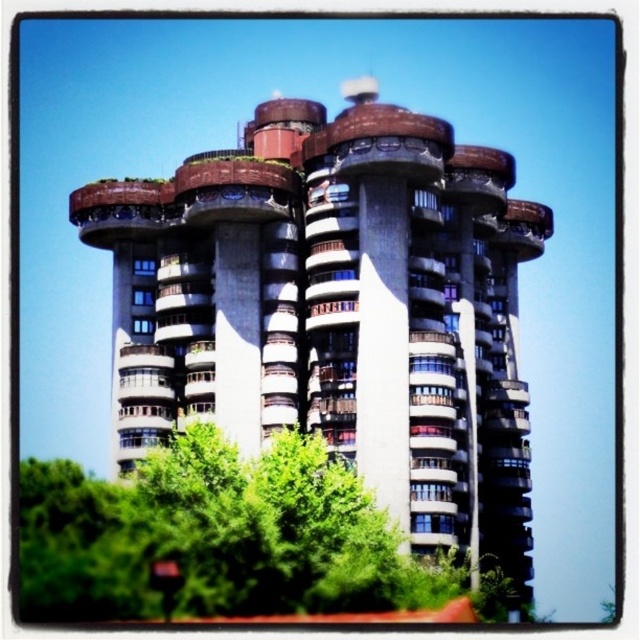
You are a bird looking for a place to perch. You can choose between the concrete building at center and the green leafy tree at lower center. Which option is taller?

The concrete building at center is much taller than the green leafy tree at lower center, so the bird should choose the concrete building at center for a higher perch.

You are an architect evaluating the design of the concrete building at center and the green leafy tree at lower center. Which object has a smaller width according to the scene?

The concrete building at center has a lesser width compared to the green leafy tree at lower center, so the concrete building at center is narrower.